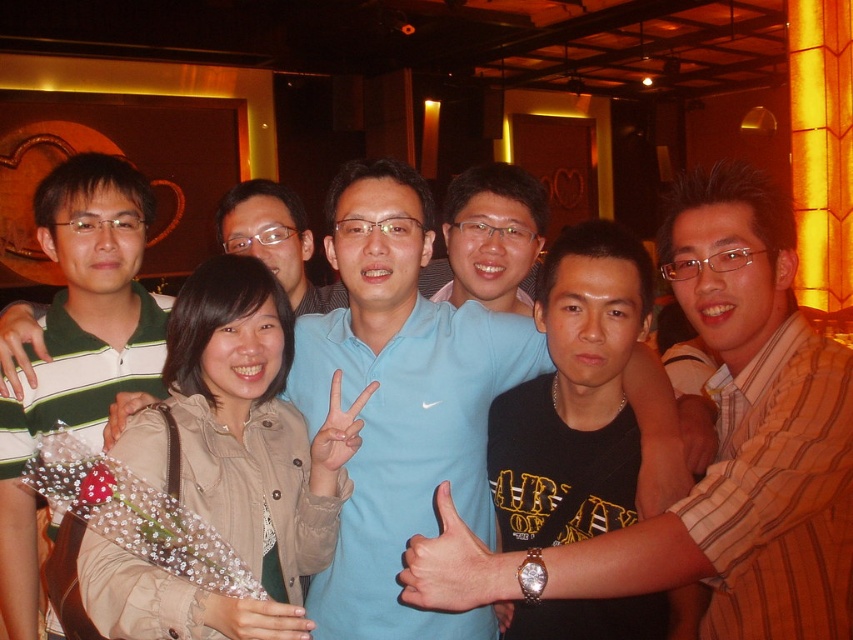
Which is in front, point (723, 298) or point (103, 237)?

Point (723, 298)

Is point (735, 394) positioned after point (47, 218)?

No, (735, 394) is in front of (47, 218).

Is point (767, 291) closer to camera compared to point (45, 404)?

Yes, point (767, 291) is in front of point (45, 404).

Where is `blue shirt at center`? Image resolution: width=853 pixels, height=640 pixels. blue shirt at center is located at coordinates (717, 452).

Does point (816, 417) lie in front of point (183, 472)?

Yes, point (816, 417) is closer to viewer.

Which is behind, point (805, 472) or point (219, 364)?

Point (219, 364)

What do you see at coordinates (717, 452) in the screenshot? The height and width of the screenshot is (640, 853). I see `blue shirt at center` at bounding box center [717, 452].

You are a GUI agent. You are given a task and a screenshot of the screen. Output one action in this format:
    pyautogui.click(x=<x>, y=<y>)
    Task: Click on the blue shirt at center
    
    Given the screenshot: What is the action you would take?
    pyautogui.click(x=717, y=452)

Which is more to the right, tan fabric jacket at center or green striped polo shirt at left?

tan fabric jacket at center

Who is more distant from viewer, (180, 371) or (1, 520)?

Positioned behind is point (1, 520).

The width and height of the screenshot is (853, 640). What are the coordinates of `tan fabric jacket at center` in the screenshot? It's located at (235, 465).